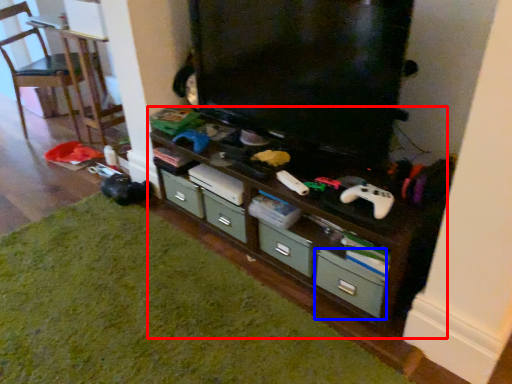
Question: Among these objects, which one is farthest to the camera, shelf (highlighted by a red box) or drawer (highlighted by a blue box)?

Choices:
 (A) shelf
 (B) drawer

Answer: (B)